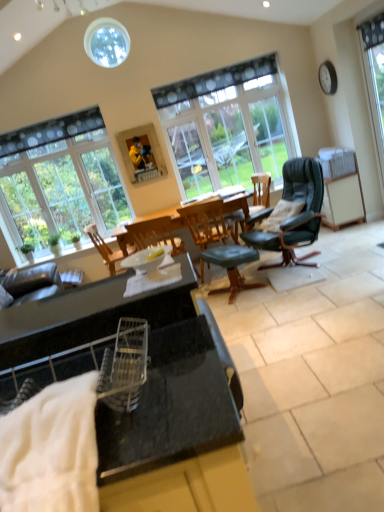
What do you see at coordinates (227, 126) in the screenshot? The width and height of the screenshot is (384, 512). I see `transparent glass window at center, the second window viewed from the left` at bounding box center [227, 126].

What do you see at coordinates (60, 180) in the screenshot? I see `clear glass window at upper left, which ranks as the 3th window in right-to-left order` at bounding box center [60, 180].

What is the approximate width of wooden chair at center, the first chair when ordered from left to right?

wooden chair at center, the first chair when ordered from left to right, is 20.61 inches wide.

Locate an element on the screen. green leafy plant at left is located at coordinates (76, 240).

Is wooden chair at center, the 3th chair viewed from the right, not near clear glass window at right, which appears as the first window when viewed from the right?

wooden chair at center, the 3th chair viewed from the right, is positioned a significant distance from clear glass window at right, which appears as the first window when viewed from the right.

The image size is (384, 512). What are the coordinates of `the 2nd chair located beneath the clear glass window at right, acting as the first window starting from the front (from a real-world perspective)` in the screenshot? It's located at (104, 248).

Which point is more forward, (102,252) or (383,137)?

Positioned in front is point (383,137).

Between wooden chair at center, the 3th chair viewed from the right, and clear glass window at right, the 3th window when ordered from back to front, which one has larger width?

wooden chair at center, the 3th chair viewed from the right, is wider.

Considering the sizes of objects green leafy plant at left and wooden chair at center, the 3th chair viewed from the right, in the image provided, who is taller, green leafy plant at left or wooden chair at center, the 3th chair viewed from the right,?

Standing taller between the two is wooden chair at center, the 3th chair viewed from the right.

Between green leafy plant at left and wooden chair at center, the 3th chair viewed from the right, which one has larger width?

With larger width is wooden chair at center, the 3th chair viewed from the right.

Considering the relative sizes of wooden chair at center, the first chair when ordered from left to right, and green leafy plant at left in the image provided, is wooden chair at center, the first chair when ordered from left to right, taller than green leafy plant at left?

Indeed, wooden chair at center, the first chair when ordered from left to right, has a greater height compared to green leafy plant at left.

Is wooden chair at center, the first chair when ordered from left to right, in contact with green leafy plant at left?

No, wooden chair at center, the first chair when ordered from left to right, is not making contact with green leafy plant at left.

In terms of width, does wooden chair at center, the 3th chair viewed from the right, look wider or thinner when compared to green leafy plant at left?

Clearly, wooden chair at center, the 3th chair viewed from the right, has more width compared to green leafy plant at left.

Does wooden chair at center, the first chair when ordered from left to right, have a larger size compared to green leafy plant at left?

Correct, wooden chair at center, the first chair when ordered from left to right, is larger in size than green leafy plant at left.

Is green leather stool at center wider than transparent glass window at center, arranged as the 2th window when viewed from the front?

Indeed, green leather stool at center has a greater width compared to transparent glass window at center, arranged as the 2th window when viewed from the front.

Does point (247, 251) come farther from viewer compared to point (252, 148)?

No, (247, 251) is in front of (252, 148).

Is green leather stool at center inside or outside of transparent glass window at center, arranged as the 2th window when viewed from the front?

green leather stool at center cannot be found inside transparent glass window at center, arranged as the 2th window when viewed from the front.

From a real-world perspective, which object rests below the other?

green leather stool at center.

From the image's perspective, is green leather chair at center, the 2th chair from the right, over wooden picture frame at upper center?

Incorrect, from the image's perspective, green leather chair at center, the 2th chair from the right, is lower than wooden picture frame at upper center.

Locate an element on the screen. picture frame on the left of green leather chair at center, the 2th chair from the right is located at coordinates (142, 153).

From a real-world perspective, is green leather chair at center, the second chair when ordered from left to right, located beneath wooden picture frame at upper center?

Yes, from a real-world perspective, green leather chair at center, the second chair when ordered from left to right, is under wooden picture frame at upper center.

Is the surface of white textured blanket at lower left in direct contact with leather-like black chair at center-right, which is the third chair in left-to-right order?

No.

From the picture: From the image's perspective, relative to leather-like black chair at center-right, which is the third chair in left-to-right order, is white textured blanket at lower left above or below?

Clearly, from the image's perspective, white textured blanket at lower left is below leather-like black chair at center-right, which is the third chair in left-to-right order.

Choose the correct answer: Is white textured blanket at lower left inside leather-like black chair at center-right, acting as the 1th chair starting from the right, or outside it?

white textured blanket at lower left is not inside leather-like black chair at center-right, acting as the 1th chair starting from the right, it's outside.

How different are the orientations of white textured blanket at lower left and leather-like black chair at center-right, which is the third chair in left-to-right order, in degrees?

The facing directions of white textured blanket at lower left and leather-like black chair at center-right, which is the third chair in left-to-right order, are 72.4 degrees apart.

Is white textured blanket at lower left completely or partially inside green leather chair at center, the 2th chair from the right?

That's incorrect, white textured blanket at lower left is not inside green leather chair at center, the 2th chair from the right.

What's the angular difference between green leather chair at center, the second chair when ordered from left to right, and white textured blanket at lower left's facing directions?

There is a 166-degree angle between the facing directions of green leather chair at center, the second chair when ordered from left to right, and white textured blanket at lower left.

Considering the relative sizes of green leather chair at center, the second chair when ordered from left to right, and white textured blanket at lower left in the image provided, is green leather chair at center, the second chair when ordered from left to right, wider than white textured blanket at lower left?

Yes, green leather chair at center, the second chair when ordered from left to right, is wider than white textured blanket at lower left.

Between green leather chair at center, the 2th chair from the right, and white textured blanket at lower left, which one appears on the left side from the viewer's perspective?

white textured blanket at lower left is more to the left.

At what (x,y) coordinates should I click in order to perform the action: click on the 3rd chair below the clear glass window at right, which appears as the first window when viewed from the right (from the image's perspective). Please return your answer as a coordinate pair (x, y). Looking at the image, I should click on (104, 248).

The image size is (384, 512). What are the coordinates of `houseplant above the wooden chair at center, the 3th chair viewed from the right (from a real-world perspective)` in the screenshot? It's located at (76, 240).

Which object lies further to the anchor point transparent glass window at center, which appears as the second window when viewed from the back, leather-like black chair at center-right, acting as the 1th chair starting from the right, or wooden chair at center, the 3th chair viewed from the right?

wooden chair at center, the 3th chair viewed from the right.

Estimate the real-world distances between objects in this image. Which object is further from clear glass window at upper left, the third window in the front-to-back sequence, green leather chair at center, the 2th chair from the right, or wooden chair at center, the first chair when ordered from left to right?

Based on the image, green leather chair at center, the 2th chair from the right, appears to be further to clear glass window at upper left, the third window in the front-to-back sequence.

Estimate the real-world distances between objects in this image. Which object is further from clear glass window at right, which appears as the first window when viewed from the right, leather-like black chair at center-right, acting as the 1th chair starting from the right, or white textured blanket at lower left?

white textured blanket at lower left is positioned further to the anchor clear glass window at right, which appears as the first window when viewed from the right.

Based on their spatial positions, is leather-like black chair at center-right, which is the third chair in left-to-right order, or transparent glass window at center, arranged as the 2th window when viewed from the front, further from black granite cabinet at center?

Among the two, transparent glass window at center, arranged as the 2th window when viewed from the front, is located further to black granite cabinet at center.

Considering their positions, is black granite cabinet at center positioned further to wooden chair at center, the 3th chair viewed from the right, than green leather chair at center, the second chair when ordered from left to right?

Among the two, black granite cabinet at center is located further to wooden chair at center, the 3th chair viewed from the right.

When comparing their distances from wooden chair at center, the first chair when ordered from left to right, does clear glass window at right, the 3th window positioned from the left, or leather-like black chair at center-right, which is the third chair in left-to-right order, seem further?

The object further to wooden chair at center, the first chair when ordered from left to right, is clear glass window at right, the 3th window positioned from the left.

Looking at the image, which one is located further to black granite cabinet at center, clear glass window at right, which appears as the first window when viewed from the right, or leather-like black chair at center-right, acting as the 1th chair starting from the right?

The object further to black granite cabinet at center is clear glass window at right, which appears as the first window when viewed from the right.

Which object lies nearer to the anchor point black granite cabinet at center, green leafy plant at left or green leather stool at center?

green leather stool at center.

This screenshot has width=384, height=512. I want to click on picture frame situated between green leafy plant at left and green leather stool at center from left to right, so click(x=142, y=153).

Image resolution: width=384 pixels, height=512 pixels. Identify the location of houseplant situated between clear glass window at upper left, marked as the first window in a left-to-right arrangement, and green leather chair at center, the second chair when ordered from left to right, from left to right. (76, 240).

Where is `cabinetry located between white textured blanket at lower left and green leather chair at center, the 2th chair from the right, in the depth direction`? cabinetry located between white textured blanket at lower left and green leather chair at center, the 2th chair from the right, in the depth direction is located at coordinates (175, 433).

You are a GUI agent. You are given a task and a screenshot of the screen. Output one action in this format:
    pyautogui.click(x=<x>, y=<y>)
    Task: Click on the picture frame between green leafy plant at left and transparent glass window at center, arranged as the 2th window when viewed from the front, in the horizontal direction
    The height and width of the screenshot is (512, 384).
    Given the screenshot: What is the action you would take?
    pyautogui.click(x=142, y=153)